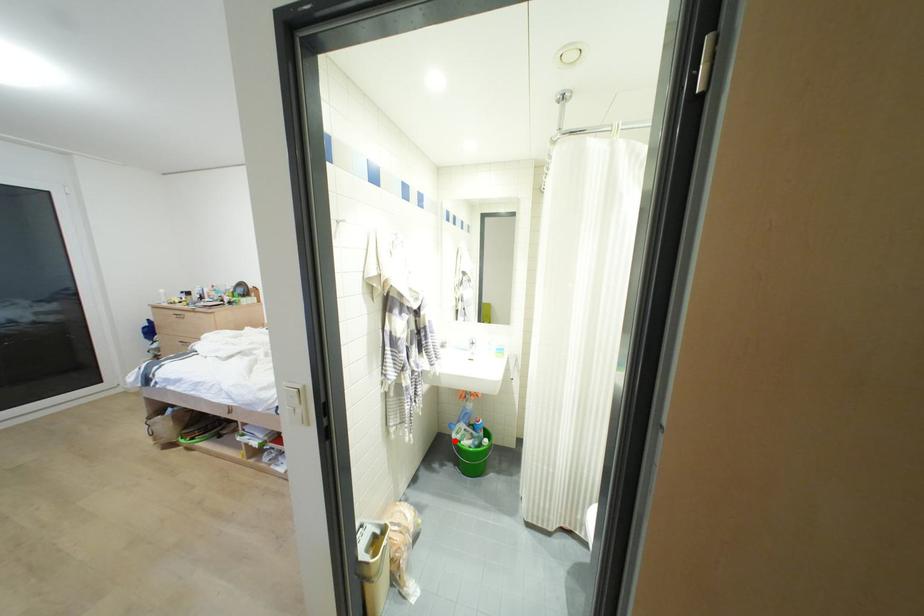
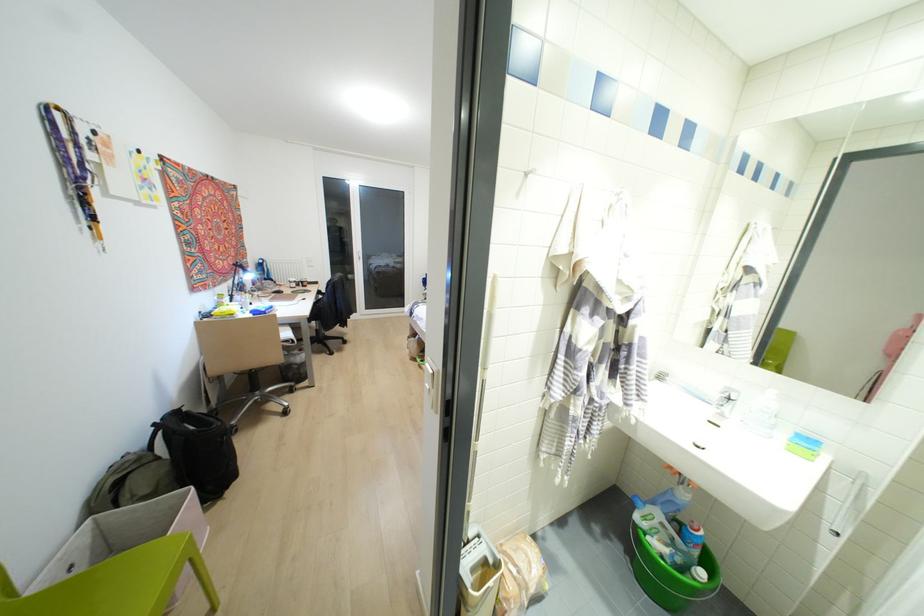
Question: I am providing you with two images of the same scene from different viewpoints. A red point is shown in image1. For the corresponding object point in image2, is it positioned nearer or farther from the camera?

Choices:
 (A) Nearer
 (B) Farther

Answer: (A)